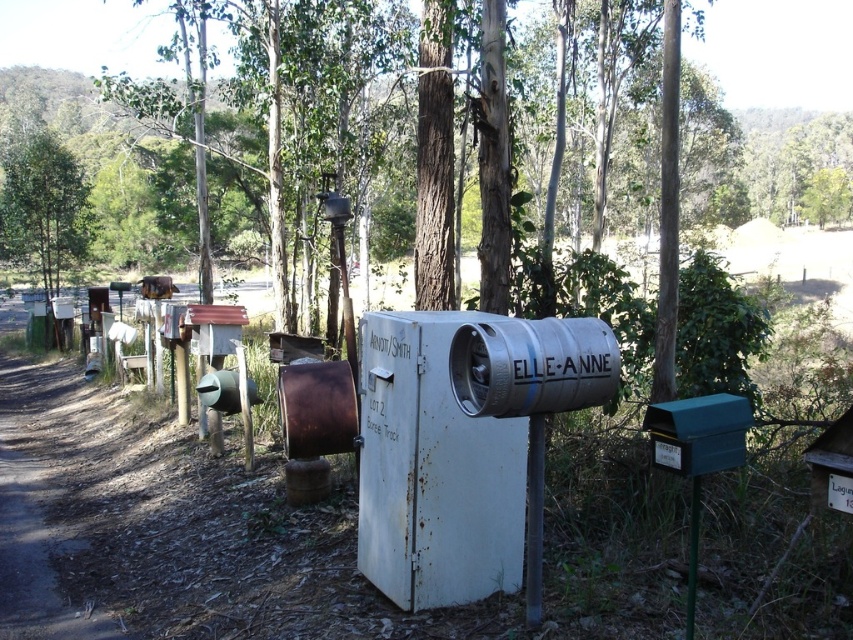
Can you confirm if rusty metal mailbox at center is positioned below green leafy tree at upper left?

Indeed, rusty metal mailbox at center is positioned under green leafy tree at upper left.

This screenshot has width=853, height=640. What do you see at coordinates (433, 470) in the screenshot?
I see `rusty metal mailbox at center` at bounding box center [433, 470].

Which is behind, point (480, 465) or point (18, 209)?

The point (18, 209) is behind.

This screenshot has width=853, height=640. In order to click on rusty metal mailbox at center in this screenshot , I will do `click(433, 470)`.